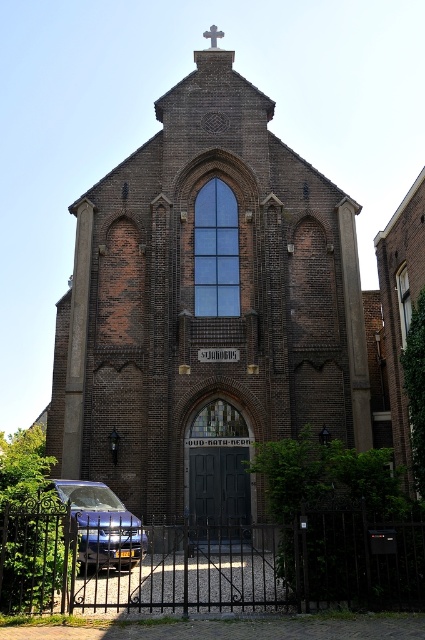
You are standing in front of the church and notice two points marked on the facade. Which point is closer to you, point (198, 369) or point (127, 541)?

Point (198, 369) is closer to you than point (127, 541) because it is further to the viewer.

You are a visitor arriving at the church and see the satin blue car at lower left and the white stone cross at upper center. Which object is positioned more to the left side of the scene?

The satin blue car at lower left is positioned more to the left side of the scene than the white stone cross at upper center.